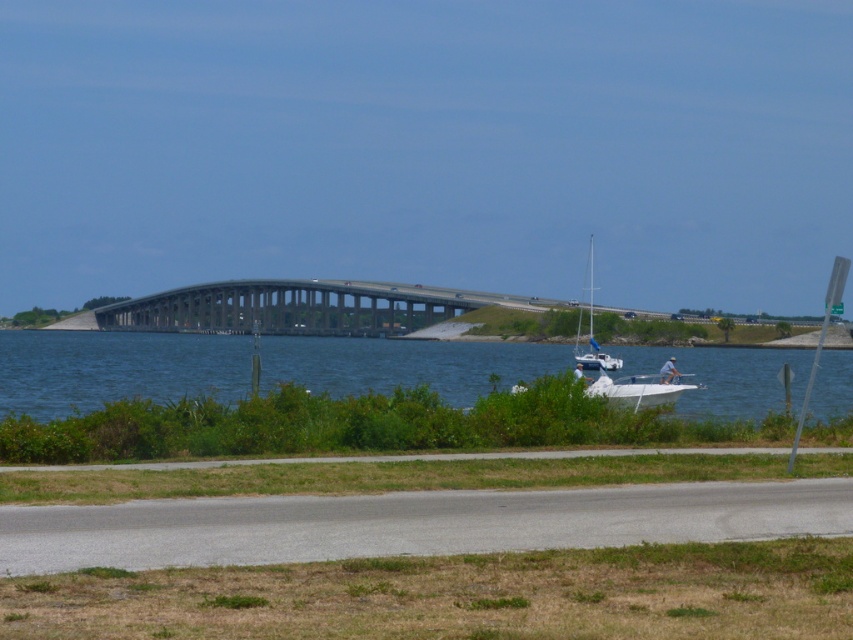
Question: Considering the relative positions of gray concrete bridge at center and white matte sailboat at center-right in the image provided, where is gray concrete bridge at center located with respect to white matte sailboat at center-right?

Choices:
 (A) above
 (B) below

Answer: (B)

Question: Which object is closer to the camera taking this photo?

Choices:
 (A) gray concrete bridge at center
 (B) blue water at lower center

Answer: (B)

Question: Does blue water at lower center appear on the left side of white matte sailboat at center-right?

Choices:
 (A) no
 (B) yes

Answer: (B)

Question: Based on their relative distances, which object is nearer to the gray concrete bridge at center?

Choices:
 (A) blue water at lower center
 (B) white matte sailboat at center-right

Answer: (A)

Question: Is blue water at lower center wider than gray concrete bridge at center?

Choices:
 (A) yes
 (B) no

Answer: (A)

Question: Which point is closer to the camera?

Choices:
 (A) blue water at lower center
 (B) white matte sailboat at center-right

Answer: (A)